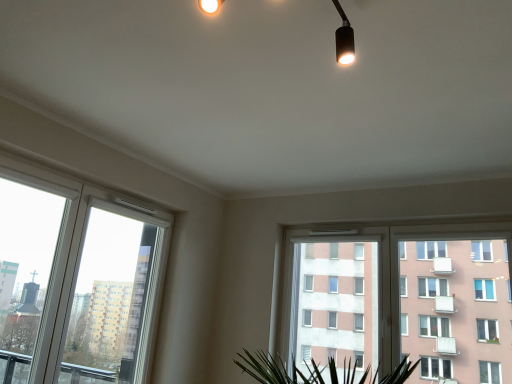
Question: In the image, is white plastic window at center, the 2th window positioned from the left, on the left side or the right side of white plastic window at left, which ranks as the 2th window in right-to-left order?

Choices:
 (A) left
 (B) right

Answer: (B)

Question: Which is correct: white plastic window at center, the 2th window positioned from the left, is inside white plastic window at left, the 1th window in the left-to-right sequence, or outside of it?

Choices:
 (A) inside
 (B) outside

Answer: (B)

Question: Relative to white plastic window at left, which ranks as the 2th window in right-to-left order, is white plastic window at center, the 2th window positioned from the left, in front or behind?

Choices:
 (A) front
 (B) behind

Answer: (B)

Question: Which is correct: white plastic window at left, which ranks as the 2th window in right-to-left order, is inside white plastic window at center, arranged as the first window when viewed from the right, or outside of it?

Choices:
 (A) outside
 (B) inside

Answer: (A)

Question: Looking at the image, does white plastic window at left, which ranks as the 2th window in right-to-left order, seem bigger or smaller compared to white plastic window at center, the 2th window positioned from the left?

Choices:
 (A) small
 (B) big

Answer: (A)

Question: Relative to white plastic window at center, arranged as the first window when viewed from the right, is white plastic window at left, which ranks as the 2th window in right-to-left order, in front or behind?

Choices:
 (A) front
 (B) behind

Answer: (A)

Question: Would you say white plastic window at left, the 1th window in the left-to-right sequence, is to the left or to the right of white plastic window at center, arranged as the first window when viewed from the right, in the picture?

Choices:
 (A) left
 (B) right

Answer: (A)